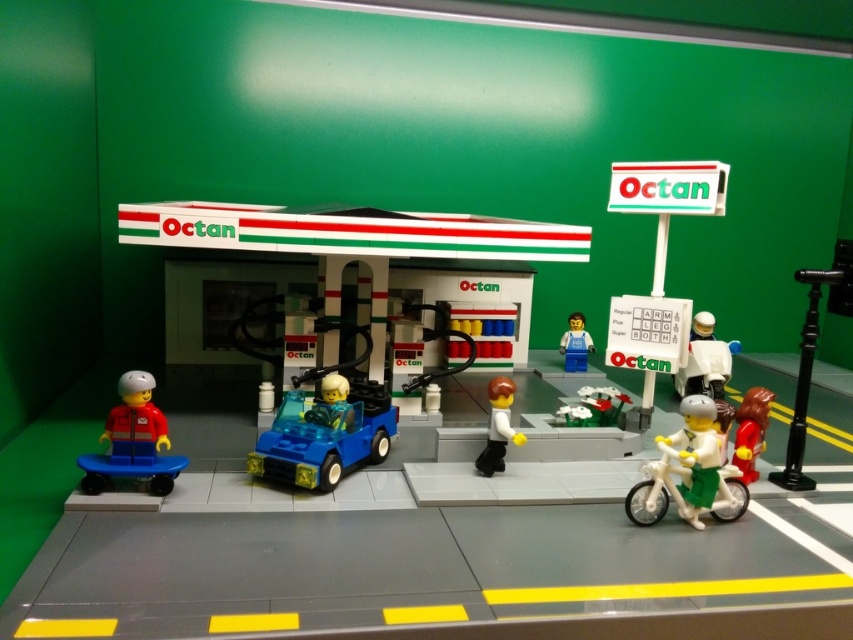
Which is behind, point (486, 474) or point (585, 360)?

Point (585, 360)

Does white matte figure at center have a smaller size compared to blue plastic minifigure at center?

No.

Who is more distant from viewer, (497,385) or (582,364)?

The point (582,364) is behind.

Locate an element on the screen. The image size is (853, 640). white matte figure at center is located at coordinates (498, 426).

Between point (688, 499) and point (616, 417), which one is positioned behind?

The point (616, 417) is more distant.

Can you confirm if green plastic motorcycle at center-right is taller than green matte flower bed at center?

Indeed, green plastic motorcycle at center-right has a greater height compared to green matte flower bed at center.

Between point (671, 488) and point (619, 410), which one is positioned behind?

The point (619, 410) is more distant.

Locate an element on the screen. green plastic motorcycle at center-right is located at coordinates (686, 490).

Is white matte scooter at right shorter than blue plastic minifigure at center?

In fact, white matte scooter at right may be taller than blue plastic minifigure at center.

Where is `white matte scooter at right`? The width and height of the screenshot is (853, 640). white matte scooter at right is located at coordinates click(705, 358).

Between point (708, 360) and point (561, 339), which one is positioned in front?

Positioned in front is point (708, 360).

This screenshot has height=640, width=853. In order to click on white matte scooter at right in this screenshot , I will do `click(705, 358)`.